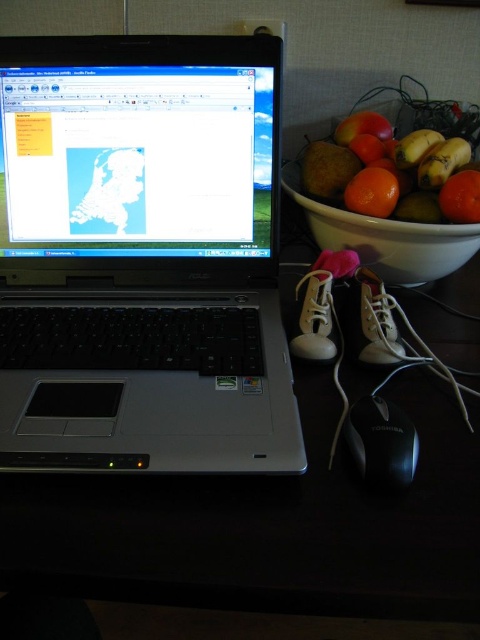
You are a delivery person who just arrived at the office and need to place a package on the nearest available surface. The package is 10 cm wide. You can see the black plastic table at lower center and the shiny orange fruit at right. Which surface can you place the package on?

The black plastic table at lower center is closer to the viewer than the shiny orange fruit at right, so you can place the package on the black plastic table at lower center since it is the nearest available surface.